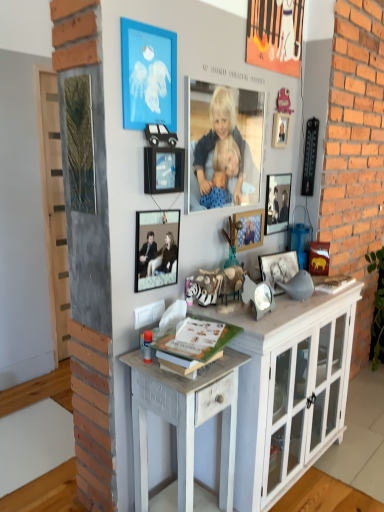
Question: Looking at their shapes, would you say black matte picture frame at center, the fifth picture frame viewed from the left, is wider or thinner than green matte book at center?

Choices:
 (A) thin
 (B) wide

Answer: (A)

Question: Is black matte picture frame at center, the fifth picture frame viewed from the left, taller or shorter than green matte book at center?

Choices:
 (A) tall
 (B) short

Answer: (A)

Question: Which of these objects is positioned closest to the metallic silver picture frame at upper center, acting as the 3th picture frame starting from the left?

Choices:
 (A) white painted wood cabinet at center
 (B) metallic silver photo frame at center, placed as the first picture frame when sorted from right to left
 (C) green matte book at center
 (D) blue matte picture frame at upper center, which is counted as the sixth picture frame, starting from the right
 (E) smooth blue fabric at center

Answer: (D)

Question: Which is farther from the green matte book at center?

Choices:
 (A) blue matte picture frame at upper center, which is counted as the sixth picture frame, starting from the right
 (B) metallic silver picture frame at upper center, the fourth picture frame when ordered from right to left
 (C) metallic silver frame at center, which is counted as the 2th picture frame, starting from the left
 (D) metallic silver photo frame at center, which ranks as the 6th picture frame in left-to-right order
 (E) white painted wood cabinet at center

Answer: (D)